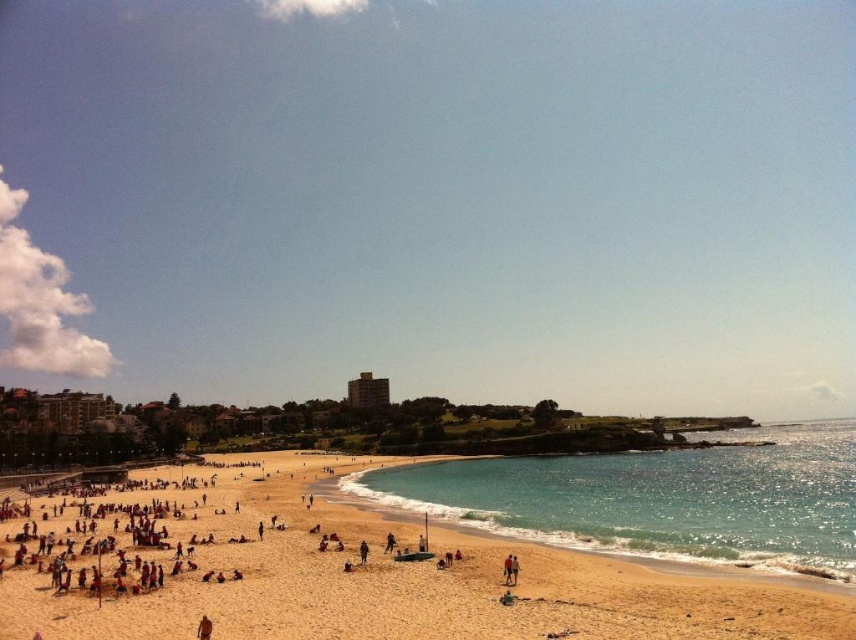
Looking at this image, you are standing on the golden sand beach at lower left and want to reach the clear blue water at center. Which direction should you move towards?

You should move to the right towards the clear blue water at center since the golden sand beach at lower left is located to its left.

Based on the photo, you are standing at the beach and see two points marked on the sand. The first point is at coordinates point (321, 602) and the second point is at point (611, 520). Which point is closer to you?

Point (321, 602) is closer to the camera than point (611, 520), so the first point is closer to you.

You are a lifeguard standing on the beach and need to reach the water quickly. Which direction should you go to reach the clear blue water at center from the golden sand beach at lower left?

The golden sand beach at lower left is thinner than the clear blue water at center, so to reach the clear blue water at center quickly, you should head towards the center from the golden sand beach at lower left as it is the closest path.